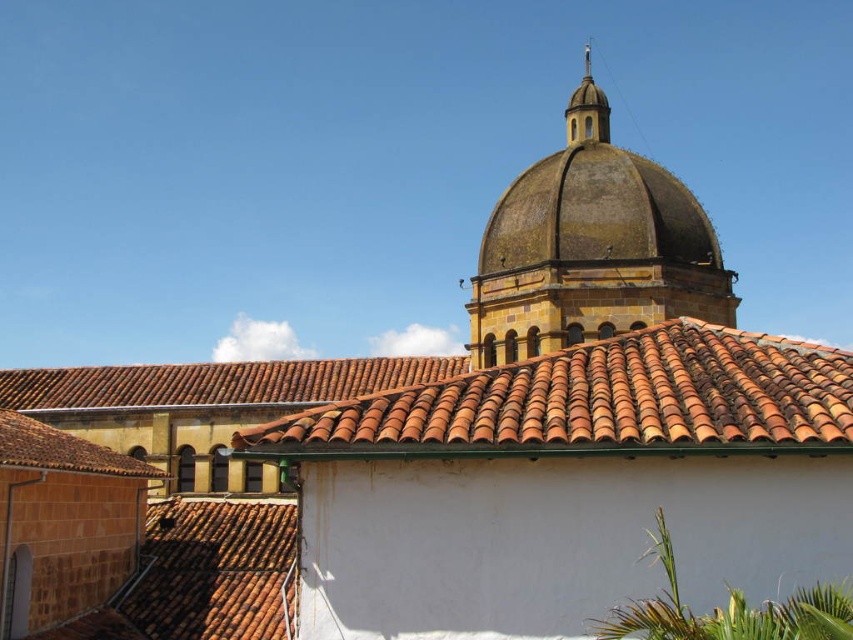
Find the location of a particular element. Image resolution: width=853 pixels, height=640 pixels. terracotta tiles at center is located at coordinates (601, 401).

Which is behind, point (370, 442) or point (564, 148)?

Positioned behind is point (564, 148).

Is point (445, 410) farther from camera compared to point (490, 224)?

No, (445, 410) is in front of (490, 224).

Locate an element on the screen. The image size is (853, 640). terracotta tiles at center is located at coordinates (601, 401).

Between rusty stone dome at upper center and smooth gold dome at upper center, which one is positioned lower?

rusty stone dome at upper center is lower down.

Who is more distant from viewer, (572,163) or (602,138)?

The point (602,138) is more distant.

Identify the location of rusty stone dome at upper center. This screenshot has height=640, width=853. click(x=595, y=214).

This screenshot has width=853, height=640. Describe the element at coordinates (590, 248) in the screenshot. I see `brown textured dome at center` at that location.

Can you confirm if brown textured dome at center is taller than smooth gold dome at upper center?

Correct, brown textured dome at center is much taller as smooth gold dome at upper center.

Between point (503, 237) and point (585, 65), which one is positioned in front?

Point (503, 237) is in front.

This screenshot has height=640, width=853. What are the coordinates of `brown textured dome at center` in the screenshot? It's located at (590, 248).